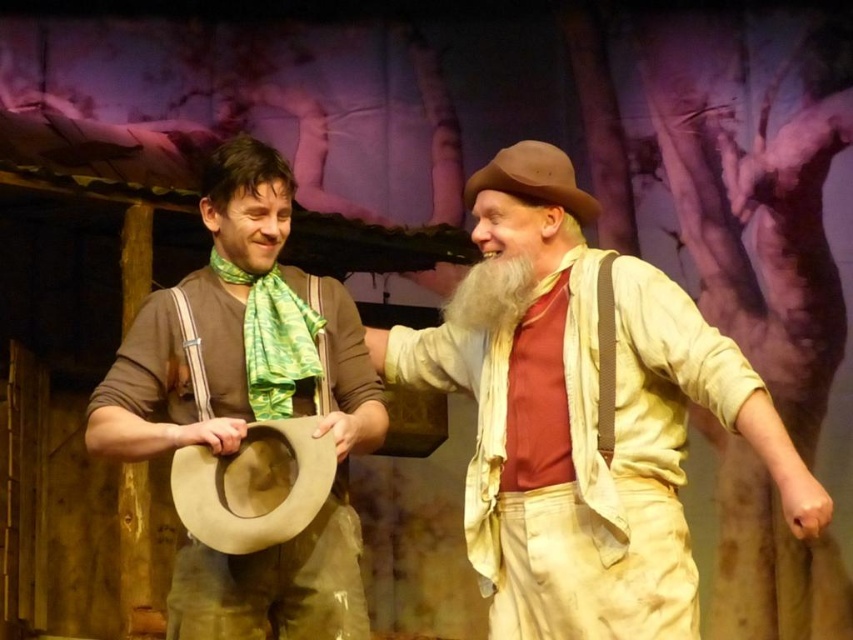
From the picture: Is beige cotton shirt at center to the left of brown leather hat at left from the viewer's perspective?

Incorrect, beige cotton shirt at center is not on the left side of brown leather hat at left.

Does beige cotton shirt at center appear under brown leather hat at left?

Yes.

What do you see at coordinates (585, 420) in the screenshot? This screenshot has width=853, height=640. I see `beige cotton shirt at center` at bounding box center [585, 420].

Where is `beige cotton shirt at center`? beige cotton shirt at center is located at coordinates (585, 420).

Which is in front, point (796, 481) or point (479, 276)?

Point (796, 481) is in front.

Who is taller, beige cotton shirt at center or white fluffy beard at center?

With more height is beige cotton shirt at center.

Is point (660, 488) farther from camera compared to point (502, 276)?

No, (660, 488) is closer to viewer.

At what (x,y) coordinates should I click in order to perform the action: click on beige cotton shirt at center. Please return your answer as a coordinate pair (x, y). Looking at the image, I should click on 585,420.

Looking at this image, can you confirm if brown leather hat at left is bigger than brown suede cowboy hat at left?

Yes.

Which is in front, point (125, 349) or point (206, 472)?

Point (206, 472)

Is point (287, 561) closer to camera compared to point (329, 484)?

That is False.

This screenshot has height=640, width=853. Find the location of `brown leather hat at left`. brown leather hat at left is located at coordinates coord(239,332).